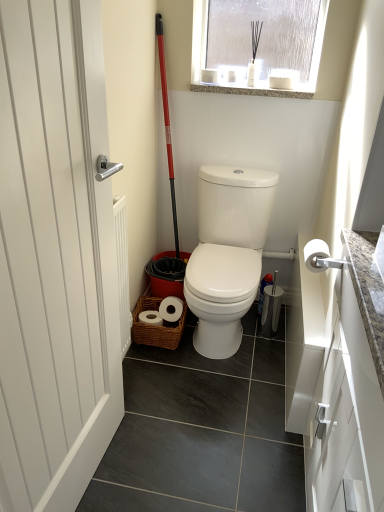
What do you see at coordinates (259, 44) in the screenshot? The width and height of the screenshot is (384, 512). I see `frosted glass window at upper center` at bounding box center [259, 44].

In order to face frosted glass window at upper center, should I rotate leftwards or rightwards?

Rotate your view right by about 8.846°.

The image size is (384, 512). Describe the element at coordinates (316, 255) in the screenshot. I see `white matte toilet paper at right` at that location.

Locate an element on the screen. Image resolution: width=384 pixels, height=512 pixels. white matte door at left is located at coordinates (55, 256).

This screenshot has width=384, height=512. Identify the location of white glossy toilet at center. (227, 254).

Looking at this image, are white matte door at left and granite at upper center beside each other?

No, white matte door at left is not making contact with granite at upper center.

Is the depth of white matte door at left less than that of granite at upper center?

Yes, white matte door at left is closer to the camera.

Visually, is white matte door at left positioned to the left or to the right of granite at upper center?

From the image, it's evident that white matte door at left is to the left of granite at upper center.

From the image's perspective, is white matte door at left above or below frosted glass window at upper center?

Clearly, from the image's perspective, white matte door at left is below frosted glass window at upper center.

At what (x,y) coordinates should I click in order to perform the action: click on door that appears below the frosted glass window at upper center (from the image's perspective). Please return your answer as a coordinate pair (x, y). The height and width of the screenshot is (512, 384). Looking at the image, I should click on (55, 256).

Is frosted glass window at upper center at the back of white matte door at left?

That's not correct — white matte door at left is not looking away from frosted glass window at upper center.

From the image's perspective, is frosted glass window at upper center located above or below white matte door at left?

From the image's perspective, frosted glass window at upper center appears above white matte door at left.

From the picture: Is frosted glass window at upper center facing towards white matte door at left?

Yes, frosted glass window at upper center faces towards white matte door at left.

Is frosted glass window at upper center spatially inside white matte door at left, or outside of it?

frosted glass window at upper center is spatially situated outside white matte door at left.

Considering the relative sizes of frosted glass window at upper center and white matte door at left in the image provided, is frosted glass window at upper center bigger than white matte door at left?

No.

From the image's perspective, between white matte toilet paper at right and granite at upper center, who is located below?

white matte toilet paper at right appears lower in the image.

Considering the relative positions of white matte toilet paper at right and granite at upper center in the image provided, is white matte toilet paper at right in front of granite at upper center?

Yes, the depth of white matte toilet paper at right is less than that of granite at upper center.

How much distance is there between white matte toilet paper at right and granite at upper center?

white matte toilet paper at right is 35.14 inches from granite at upper center.

Which is behind, point (312, 255) or point (225, 82)?

The point (225, 82) is farther.

Can you confirm if white matte toilet paper at right is shorter than frosted glass window at upper center?

Yes, white matte toilet paper at right is shorter than frosted glass window at upper center.

From the image's perspective, which object appears higher, white matte toilet paper at right or frosted glass window at upper center?

frosted glass window at upper center is shown above in the image.

Is white matte toilet paper at right positioned before frosted glass window at upper center?

Yes, it is.

Is white matte toilet paper at right surrounding frosted glass window at upper center?

No, frosted glass window at upper center is not inside white matte toilet paper at right.

Is frosted glass window at upper center a part of granite at upper center?

That's incorrect, frosted glass window at upper center is not inside granite at upper center.

Does granite at upper center have a greater height compared to frosted glass window at upper center?

No, granite at upper center is not taller than frosted glass window at upper center.

Are granite at upper center and frosted glass window at upper center beside each other?

No, granite at upper center is not touching frosted glass window at upper center.

This screenshot has height=512, width=384. Identify the location of window sill below the frosted glass window at upper center (from a real-world perspective). (252, 89).

Is white glossy toilet at center far away from white matte toilet paper at right?

white glossy toilet at center is actually quite close to white matte toilet paper at right.

Is white glossy toilet at center to the left or to the right of white matte toilet paper at right in the image?

In the image, white glossy toilet at center appears on the left side of white matte toilet paper at right.

The image size is (384, 512). What are the coordinates of `toilet paper lying in front of the white glossy toilet at center` in the screenshot? It's located at (316, 255).

Can you tell me how much white glossy toilet at center and white matte toilet paper at right differ in facing direction?

The angle between the facing direction of white glossy toilet at center and the facing direction of white matte toilet paper at right is 2.2 degrees.

Find the location of `door in front of the granite at upper center`. door in front of the granite at upper center is located at coordinates (55, 256).

I want to click on window that is above the white matte door at left (from a real-world perspective), so click(259, 44).

When comparing their distances from frosted glass window at upper center, does white matte toilet paper at right or granite at upper center seem further?

white matte toilet paper at right is positioned further to the anchor frosted glass window at upper center.

Looking at the image, which one is located further to white glossy toilet at center, white matte toilet paper at right or white matte door at left?

Among the two, white matte door at left is located further to white glossy toilet at center.

Considering their positions, is frosted glass window at upper center positioned further to white matte door at left than granite at upper center?

granite at upper center is positioned further to the anchor white matte door at left.

Which object lies further to the anchor point white matte toilet paper at right, frosted glass window at upper center or granite at upper center?

Based on the image, frosted glass window at upper center appears to be further to white matte toilet paper at right.

In the scene shown: Which object lies nearer to the anchor point granite at upper center, frosted glass window at upper center or white matte toilet paper at right?

Among the two, frosted glass window at upper center is located nearer to granite at upper center.

When comparing their distances from white glossy toilet at center, does frosted glass window at upper center or white matte toilet paper at right seem further?

Among the two, frosted glass window at upper center is located further to white glossy toilet at center.

Looking at the image, which one is located further to frosted glass window at upper center, white matte door at left or white glossy toilet at center?

white matte door at left is further to frosted glass window at upper center.

Considering their positions, is white matte door at left positioned further to frosted glass window at upper center than granite at upper center?

Based on the image, white matte door at left appears to be further to frosted glass window at upper center.

What are the coordinates of `toilet paper between white matte door at left and frosted glass window at upper center in the front-back direction` in the screenshot? It's located at (316, 255).

I want to click on toilet paper between white matte door at left and granite at upper center along the z-axis, so click(x=316, y=255).

The image size is (384, 512). What are the coordinates of `toilet between white matte door at left and frosted glass window at upper center along the z-axis` in the screenshot? It's located at (227, 254).

You are a GUI agent. You are given a task and a screenshot of the screen. Output one action in this format:
    pyautogui.click(x=<x>, y=<y>)
    Task: Click on the window between white matte door at left and granite at upper center in the front-back direction
    
    Given the screenshot: What is the action you would take?
    pyautogui.click(x=259, y=44)